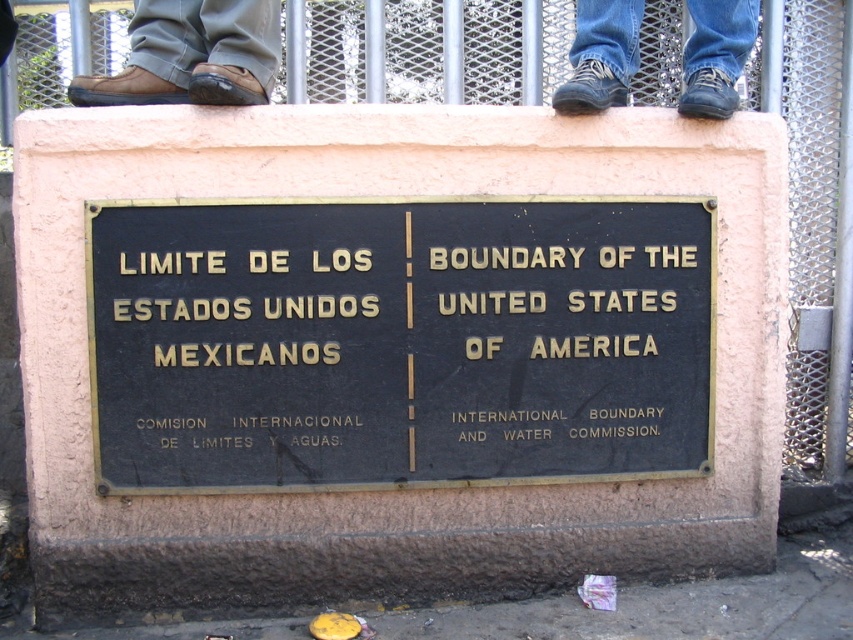
Question: Can you confirm if brown suede shoe at lower left is wider than matte brown shoe at upper center?

Choices:
 (A) yes
 (B) no

Answer: (A)

Question: Which point appears closest to the camera in this image?

Choices:
 (A) (229, 93)
 (B) (637, 449)
 (C) (166, 61)

Answer: (A)

Question: Which point is farther to the camera?

Choices:
 (A) pyautogui.click(x=729, y=113)
 (B) pyautogui.click(x=585, y=456)
 (C) pyautogui.click(x=170, y=28)

Answer: (C)

Question: Does black polished metal sign at center have a greater width compared to blue jeans at upper center?

Choices:
 (A) yes
 (B) no

Answer: (A)

Question: Which point appears farthest from the camera in this image?

Choices:
 (A) (735, 96)
 (B) (199, 74)
 (C) (752, 8)

Answer: (C)

Question: Does brown suede shoe at lower left appear on the right side of matte brown shoe at upper center?

Choices:
 (A) yes
 (B) no

Answer: (B)